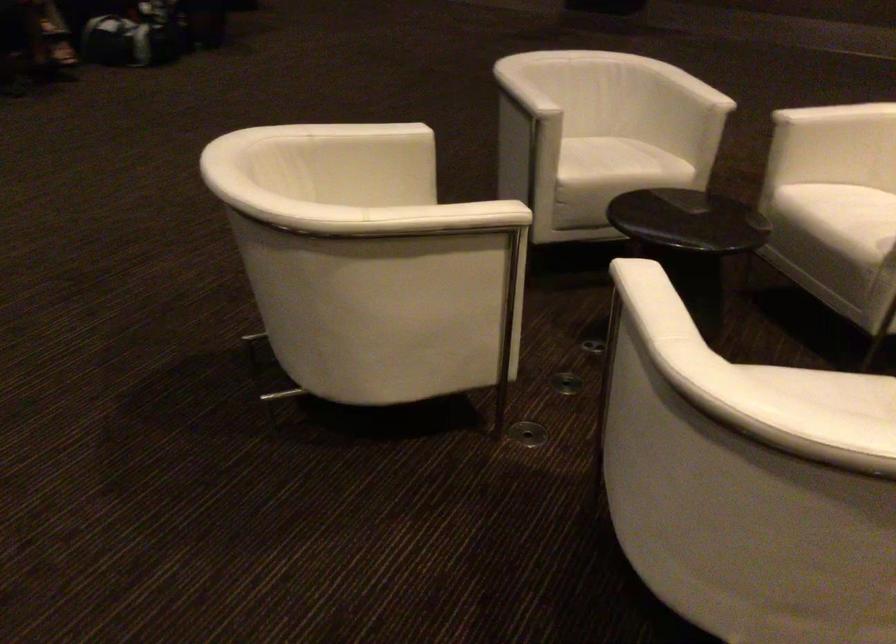
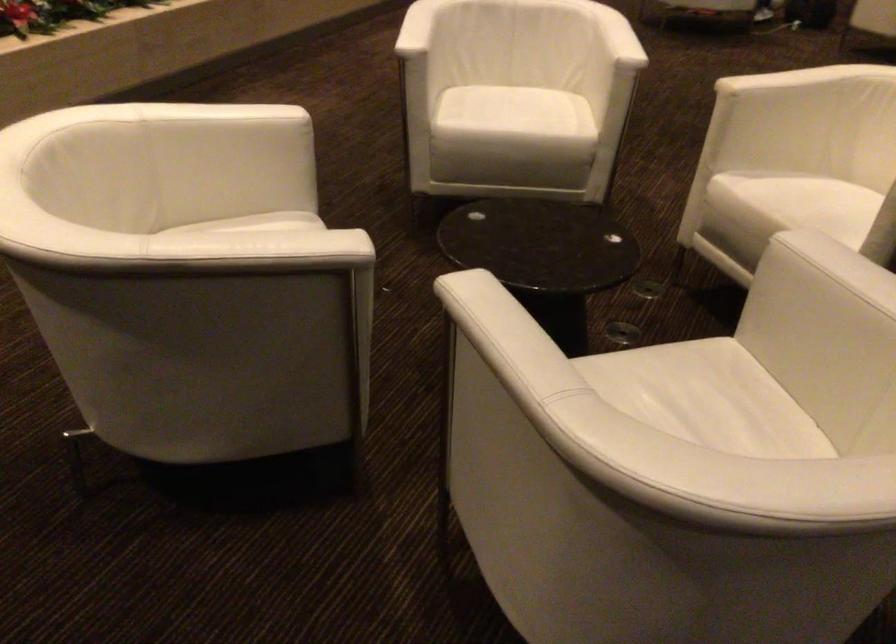
Locate, in the second image, the point that corresponds to (664,281) in the first image.

(617, 37)